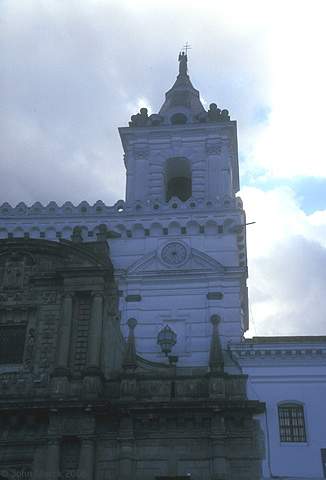
The height and width of the screenshot is (480, 326). Find the location of `window`. window is located at coordinates (177, 181), (172, 121), (291, 426).